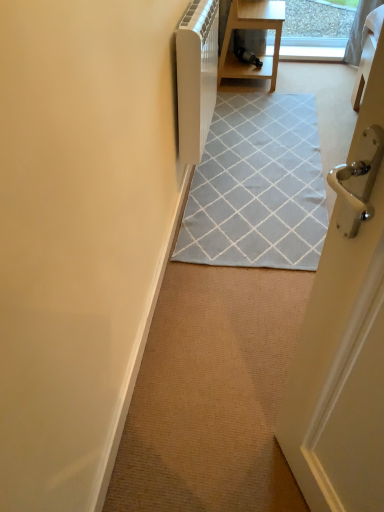
Question: Is light gray woven rug at center wider than wooden table at upper center?

Choices:
 (A) yes
 (B) no

Answer: (A)

Question: Can you confirm if light gray woven rug at center is taller than wooden table at upper center?

Choices:
 (A) no
 (B) yes

Answer: (A)

Question: From the image's perspective, does light gray woven rug at center appear lower than wooden table at upper center?

Choices:
 (A) yes
 (B) no

Answer: (A)

Question: From a real-world perspective, does light gray woven rug at center stand above wooden table at upper center?

Choices:
 (A) yes
 (B) no

Answer: (B)

Question: From a real-world perspective, is light gray woven rug at center located beneath wooden table at upper center?

Choices:
 (A) no
 (B) yes

Answer: (B)

Question: Is light gray woven rug at center inside or outside of white matte door at left?

Choices:
 (A) inside
 (B) outside

Answer: (B)

Question: Is light gray woven rug at center bigger or smaller than white matte door at left?

Choices:
 (A) small
 (B) big

Answer: (B)

Question: Is light gray woven rug at center in front of or behind white matte door at left in the image?

Choices:
 (A) front
 (B) behind

Answer: (B)

Question: From their relative heights in the image, would you say light gray woven rug at center is taller or shorter than white matte door at left?

Choices:
 (A) tall
 (B) short

Answer: (B)

Question: Considering the positions of wooden table at upper center and white matte door at left in the image, is wooden table at upper center wider or thinner than white matte door at left?

Choices:
 (A) wide
 (B) thin

Answer: (A)

Question: From the image's perspective, relative to white matte door at left, is wooden table at upper center above or below?

Choices:
 (A) above
 (B) below

Answer: (A)

Question: Would you say wooden table at upper center is to the left or to the right of white matte door at left in the picture?

Choices:
 (A) left
 (B) right

Answer: (B)

Question: In terms of height, does wooden table at upper center look taller or shorter compared to white matte door at left?

Choices:
 (A) tall
 (B) short

Answer: (A)

Question: Is white plastic radiator at upper center to the left or to the right of white matte door at left in the image?

Choices:
 (A) right
 (B) left

Answer: (A)

Question: From the image's perspective, is white plastic radiator at upper center positioned above or below white matte door at left?

Choices:
 (A) below
 (B) above

Answer: (B)